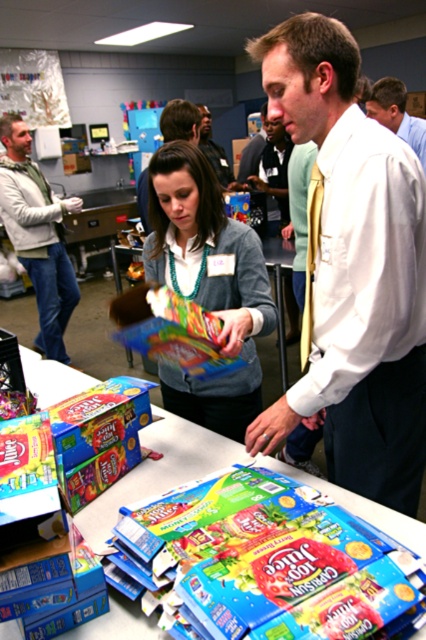
Question: Which object appears farthest from the camera in this image?

Choices:
 (A) matte white sweater at center
 (B) white shirt at upper center
 (C) blue cardboard boxes at center
 (D) matte gray sweater at center

Answer: (A)

Question: Which object appears closest to the camera in this image?

Choices:
 (A) matte black shirt at center
 (B) white shirt at upper center
 (C) matte white sweater at center
 (D) matte white shirt at center

Answer: (B)

Question: Based on their relative distances, which object is nearer to the white shirt at center?

Choices:
 (A) blue cardboard boxes at center
 (B) white shirt at upper center
 (C) matte yellow tie at center

Answer: (A)

Question: Is blue cardboard boxes at center thinner than white shirt at upper center?

Choices:
 (A) no
 (B) yes

Answer: (A)

Question: In this image, where is matte white sweater at center located relative to matte black shirt at center?

Choices:
 (A) right
 (B) left

Answer: (B)

Question: Does matte white sweater at center have a smaller size compared to matte yellow tie at center?

Choices:
 (A) no
 (B) yes

Answer: (A)